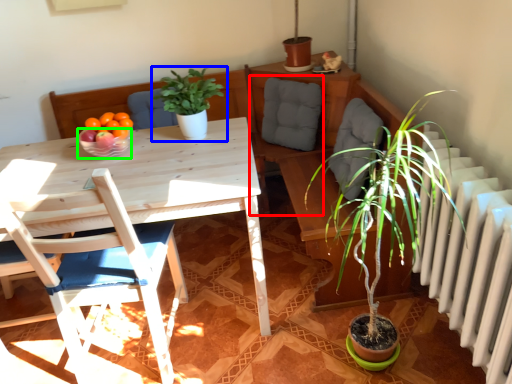
Question: Which object is positioned farthest from swivel chair (highlighted by a red box)? Select from houseplant (highlighted by a blue box) and bowl (highlighted by a green box).

Choices:
 (A) houseplant
 (B) bowl

Answer: (B)